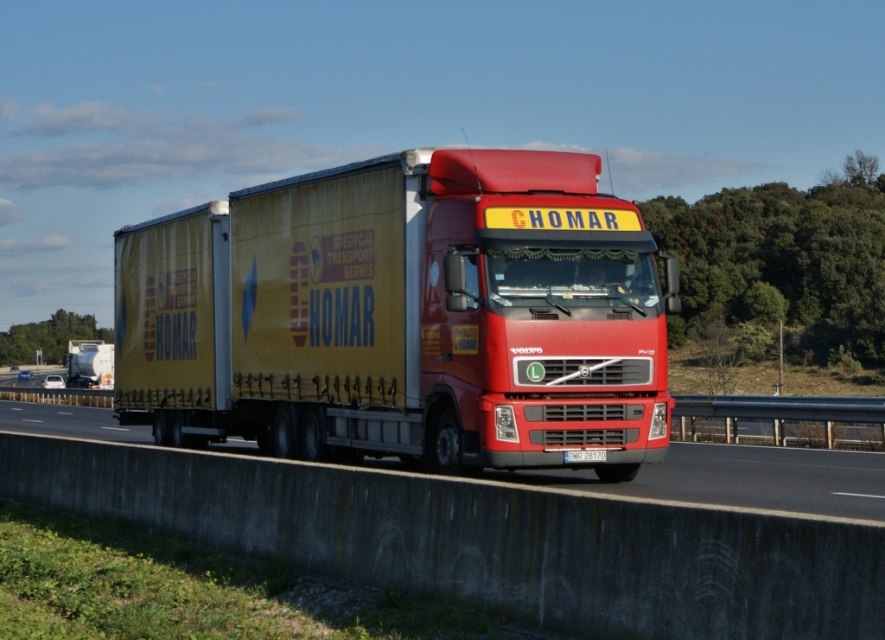
You are a truck driver who just got into the cab of the Volvo FH12 truck. You need to check if the trailer is positioned correctly before starting your journey. According to the scene, which object is taller, the matte yellow trailer at center or the white plastic license plate at center?

The matte yellow trailer at center is taller than the white plastic license plate at center, so the trailer is positioned correctly as it should be taller than the license plate.

You are a traffic officer observing a highway scene. You notice two objects labeled as matte yellow trailer truck at center and matte yellow trailer at center. Which one is positioned higher in the image?

The matte yellow trailer truck at center is positioned higher than the matte yellow trailer at center in the image.

You are a truck driver planning to pass another vehicle on this highway. You notice the matte yellow trailer truck at center and the matte yellow trailer at center. Which one has a narrower width that might allow for safer passing?

The matte yellow trailer truck at center has a lesser width compared to the matte yellow trailer at center, making it the narrower option for safer passing.